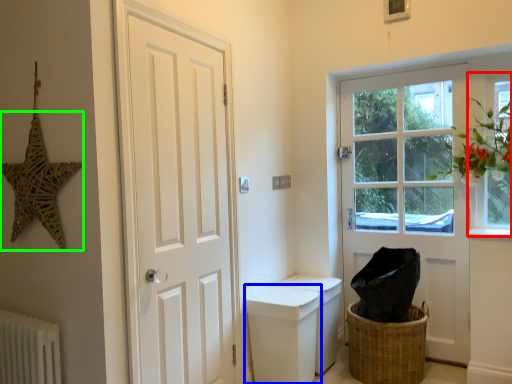
Question: Considering the real-world distances, which object is closest to window (highlighted by a red box)? toilet bowl (highlighted by a blue box) or star (highlighted by a green box).

Choices:
 (A) toilet bowl
 (B) star

Answer: (A)